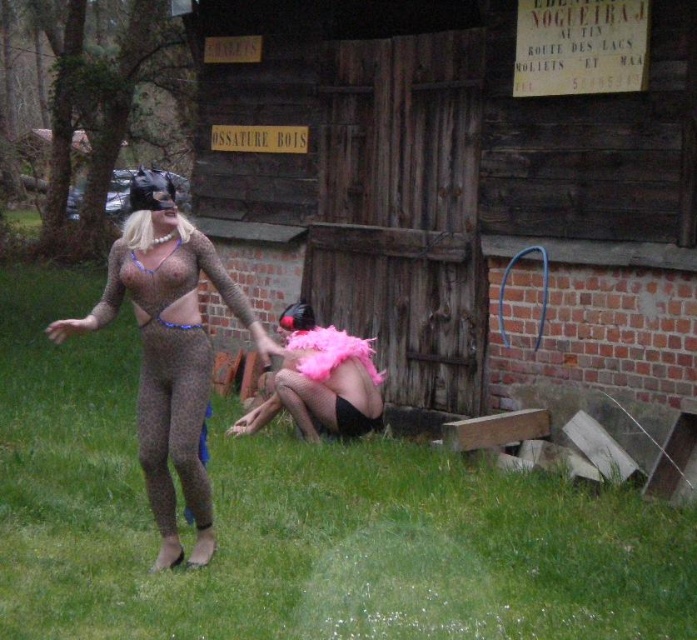
What do you see at coordinates (168, 352) in the screenshot?
I see `matte brown bodysuit at center` at bounding box center [168, 352].

Is matte brown bodysuit at center to the right of matte brown bikini top at center from the viewer's perspective?

Yes, matte brown bodysuit at center is to the right of matte brown bikini top at center.

Describe the element at coordinates (168, 352) in the screenshot. The width and height of the screenshot is (697, 640). I see `matte brown bodysuit at center` at that location.

Find the location of a particular element. matte brown bodysuit at center is located at coordinates (168, 352).

Is green grass at center to the right of translucent purple bikini top at center from the viewer's perspective?

No, green grass at center is not to the right of translucent purple bikini top at center.

Does green grass at center have a lesser height compared to translucent purple bikini top at center?

No.

Does point (93, 538) lie behind point (139, 262)?

Yes.

The height and width of the screenshot is (640, 697). Identify the location of green grass at center. (298, 522).

Who is shorter, matte brown bodysuit at center or translucent purple bikini top at center?

With less height is translucent purple bikini top at center.

Who is higher up, matte brown bodysuit at center or translucent purple bikini top at center?

translucent purple bikini top at center is above.

Is point (206, 252) positioned after point (137, 259)?

Yes, it is behind point (137, 259).

The height and width of the screenshot is (640, 697). I want to click on matte brown bodysuit at center, so click(168, 352).